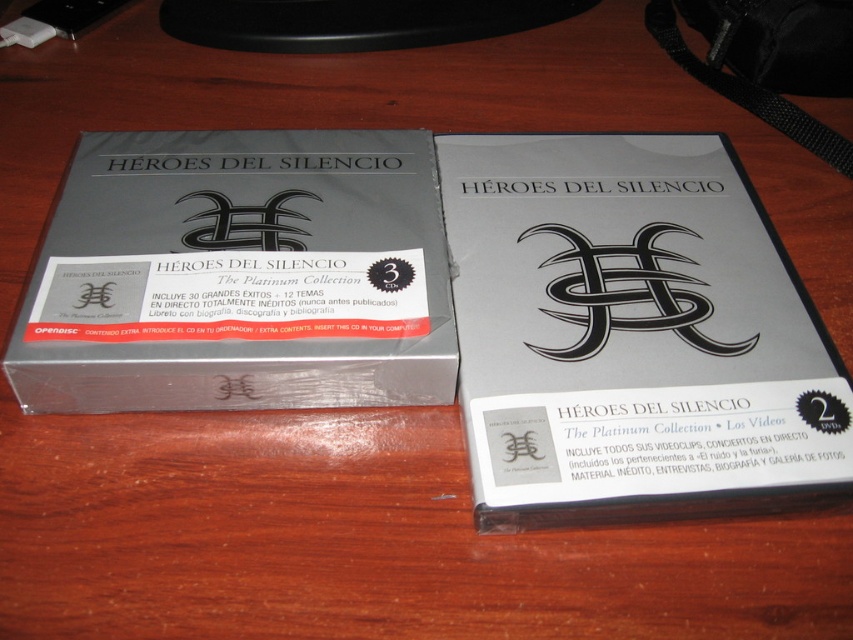
You are organizing a music collection and need to place the matte silver dvd at center and the silver metallic box at center on a shelf. Which object should be placed first to ensure stability?

The silver metallic box at center should be placed first because it is shorter than the matte silver dvd at center, allowing the taller DVD to be placed on top without tipping over.

You are organizing a music collection and have a shelf space that can accommodate items up to 15 cm in width. You have two items to place there from the image described. The items are the matte silver dvd at center and the silver metallic box at center. Which one will fit better in the available space?

The matte silver dvd at center has a lesser width compared to the silver metallic box at center, so it will fit better in the 15 cm shelf space.